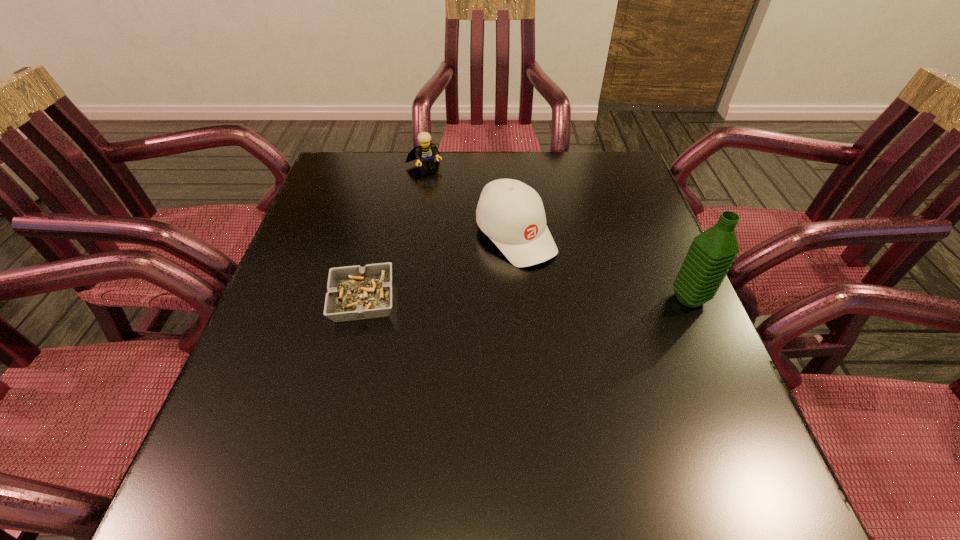
Find the location of a particular element. This screenshot has height=540, width=960. free space between the ashtray and the third nearest object is located at coordinates (440, 268).

Where is `vacant area that lies between the farthest object and the water bottle`? The image size is (960, 540). vacant area that lies between the farthest object and the water bottle is located at coordinates (557, 232).

Where is `free space between the farthest object and the shortest object`? This screenshot has height=540, width=960. free space between the farthest object and the shortest object is located at coordinates (394, 233).

Find the location of a particular element. This screenshot has width=960, height=540. free space between the farthest object and the water bottle is located at coordinates (557, 232).

Locate which object ranks second in proximity to the water bottle. Please provide its 2D coordinates. Your answer should be formatted as a tuple, i.e. [(x, y)], where the tuple contains the x and y coordinates of a point satisfying the conditions above.

[(354, 293)]

Image resolution: width=960 pixels, height=540 pixels. I want to click on object that is the closest one to the rightmost object, so click(x=511, y=213).

Locate an element on the screen. This screenshot has height=540, width=960. free location that satisfies the following two spatial constraints: 1. on the back side of the ashtray; 2. on the right side of the baseball cap is located at coordinates (378, 235).